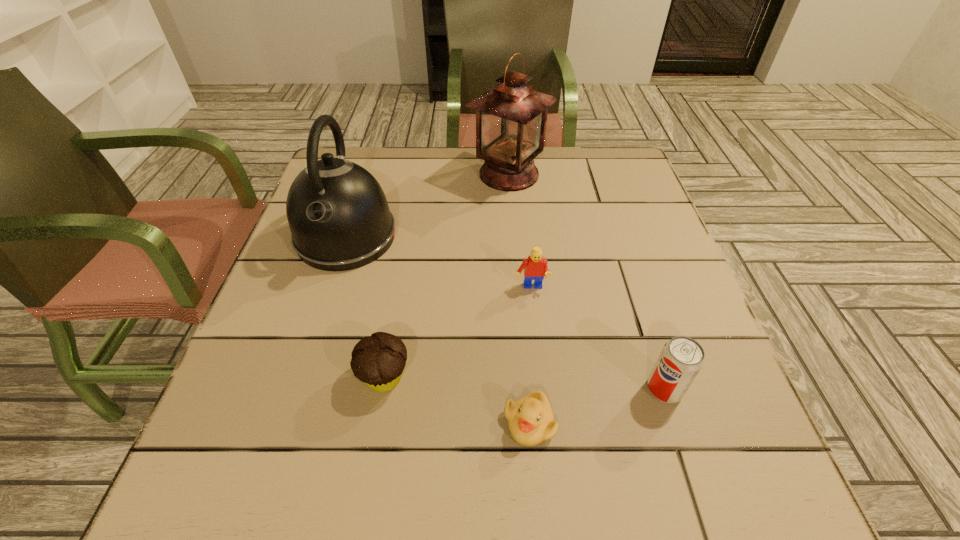
This screenshot has width=960, height=540. What are the coordinates of `vacant space situated 0.260m on the right of the fifth tallest object` in the screenshot? It's located at (560, 378).

At what (x,y) coordinates should I click in order to perform the action: click on object that is at the far edge. Please return your answer as a coordinate pair (x, y). Looking at the image, I should click on (511, 117).

At what (x,y) coordinates should I click in order to perform the action: click on object that is positioned at the left edge. Please return your answer as a coordinate pair (x, y). Looking at the image, I should click on (339, 218).

You are a GUI agent. You are given a task and a screenshot of the screen. Output one action in this format:
    pyautogui.click(x=<x>, y=<y>)
    Task: Click on the object positioned at the right edge
    Image resolution: width=960 pixels, height=540 pixels.
    Given the screenshot: What is the action you would take?
    pyautogui.click(x=681, y=359)

This screenshot has width=960, height=540. Find the location of `vacant space at the far edge of the desktop`. vacant space at the far edge of the desktop is located at coordinates (549, 191).

In order to click on vacant area at the near edge of the desktop in this screenshot , I will do [642, 498].

Locate an element on the screen. This screenshot has width=960, height=540. free location at the left edge is located at coordinates (319, 273).

In the image, there is a desktop. Where is `vacant space at the right edge`? The width and height of the screenshot is (960, 540). vacant space at the right edge is located at coordinates (627, 222).

This screenshot has width=960, height=540. In the image, there is a desktop. Identify the location of vacant space at the far left corner. (377, 146).

Identify the location of free space at the near left corner of the desktop. This screenshot has width=960, height=540. (228, 453).